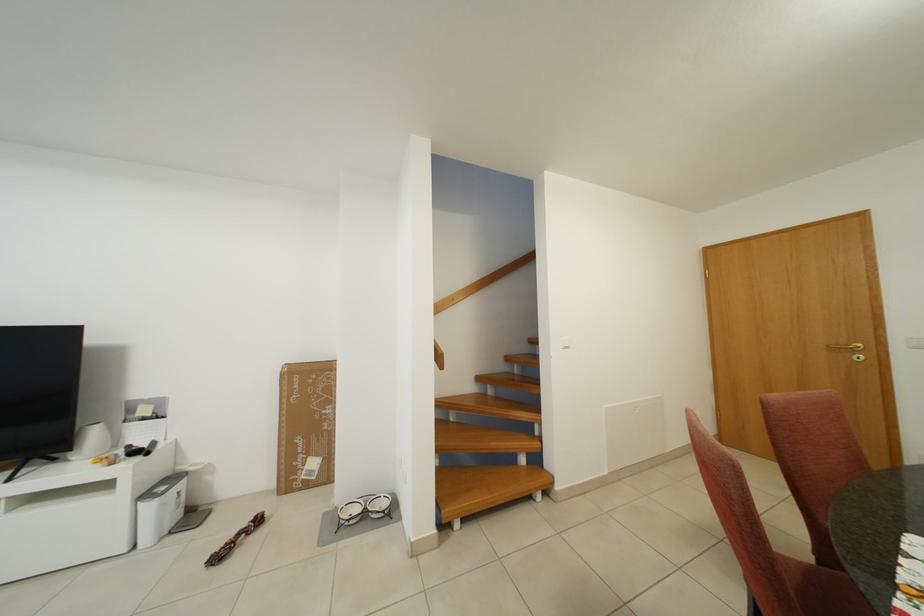
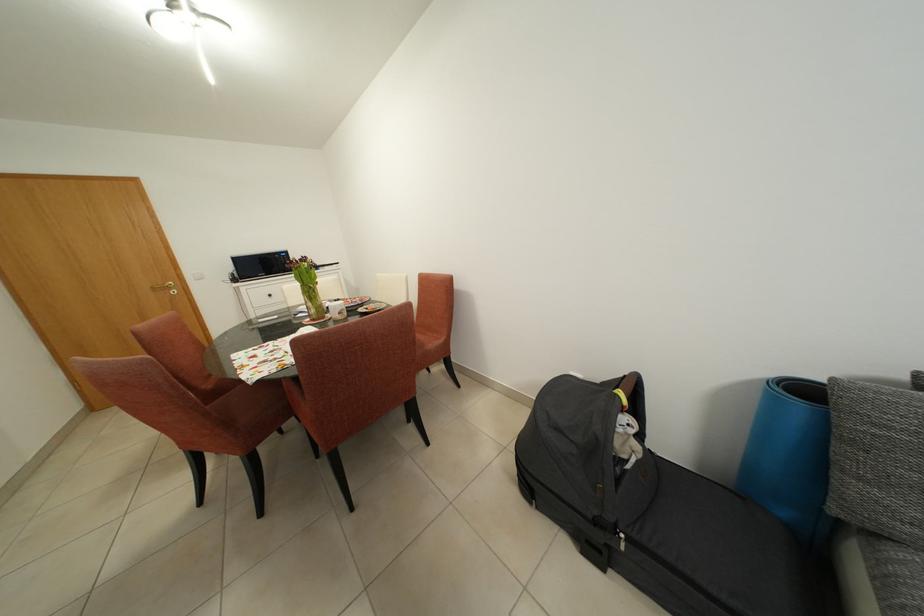
Question: Based on the continuous images, in which direction is the camera rotating? Reply with the corresponding letter.

Choices:
 (A) Left
 (B) Right
 (C) Up
 (D) Down

Answer: (B)